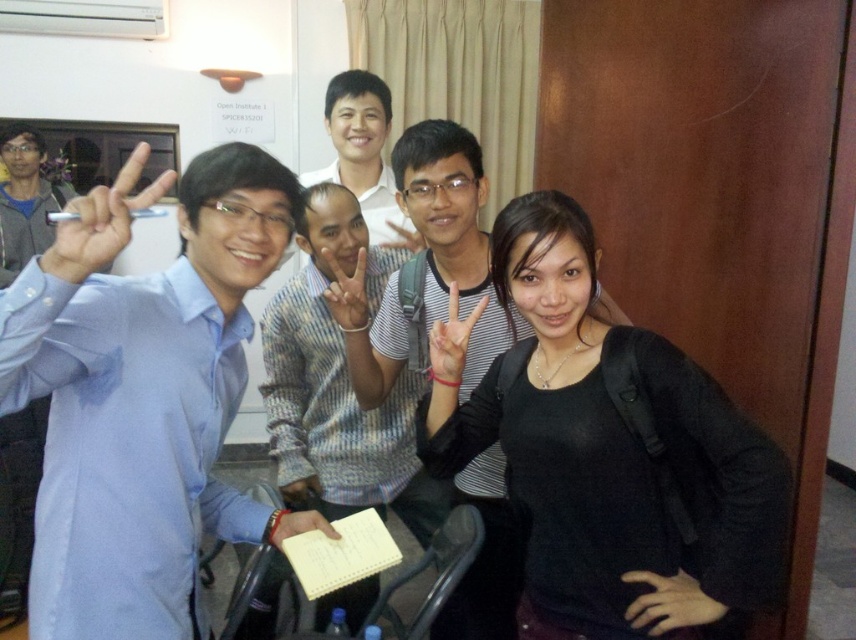
You are standing in front of the group photo. You want to reach the black matte hand at lower right without moving the light blue shirt at left. Is it possible?

The light blue shirt at left is closer to the viewer than the black matte hand at lower right, so you cannot reach the black matte hand at lower right without moving the light blue shirt at left.

You are a photographer trying to adjust the composition of this group photo. You want to ensure that the light blue shirt at left and the black matte hand at lower right are both visible in the frame. Based on their sizes, which object should you focus on to ensure both are in focus?

The light blue shirt at left is taller than the black matte hand at lower right, so focusing on the light blue shirt at left will help ensure both are in focus as it is the larger object.

You are organizing a photo shoot and need to ensure proper lighting. You have a matte gray shirt at center and a white paper at center in the frame. Which object is closer to the left side of the frame?

The white paper at center is closer to the left side of the frame because the matte gray shirt at center is positioned on the right side of it.